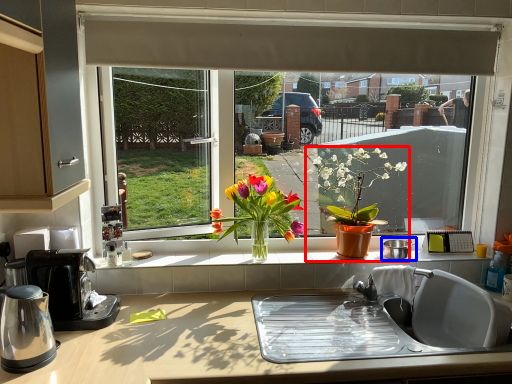
Question: Which object is closer to the camera taking this photo, houseplant (highlighted by a red box) or appliance (highlighted by a blue box)?

Choices:
 (A) houseplant
 (B) appliance

Answer: (A)